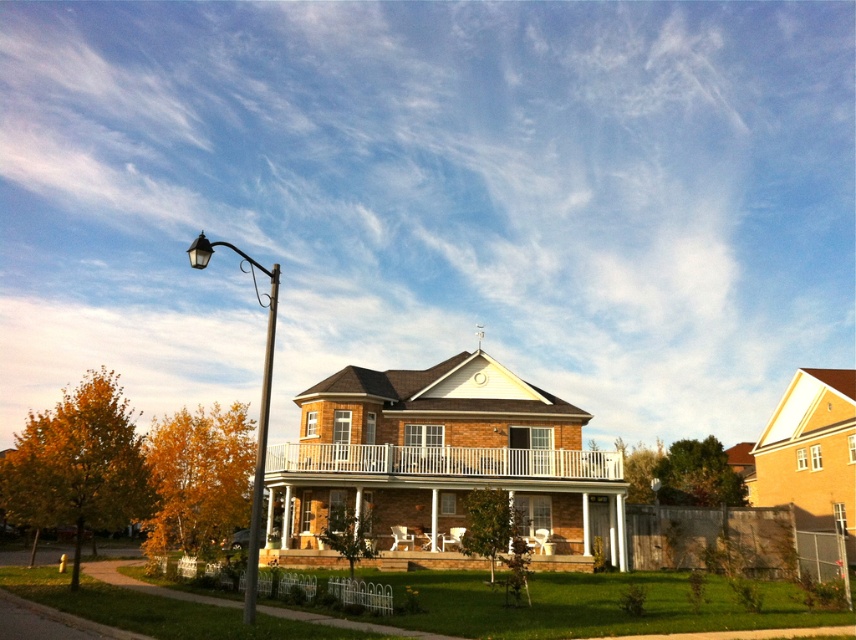
You are a delivery person approaching the house and need to park your vehicle. The parking spot is directly in front of the white painted wood balcony at center. Will the polished metal street light at left block your view of the balcony when you arrive?

The white painted wood balcony at center is located below the polished metal street light at left, so the street light will block your view of the balcony when you arrive.

You are a delivery person trying to park your 6 feet wide delivery van between the polished metal street light at left and the metallic pole at left. Can you fit the van there?

The distance between the polished metal street light at left and the metallic pole at left is 4.74 feet, which is narrower than the 6 feet width of the delivery van. Therefore, the van cannot fit between them.

You are standing in front of the house and notice two points marked on the image. One is at point coordinates (260, 436) and the other at (272, 353). Which point is closer to you?

Point (272, 353) is closer to you because it is less further to the camera than point (260, 436).